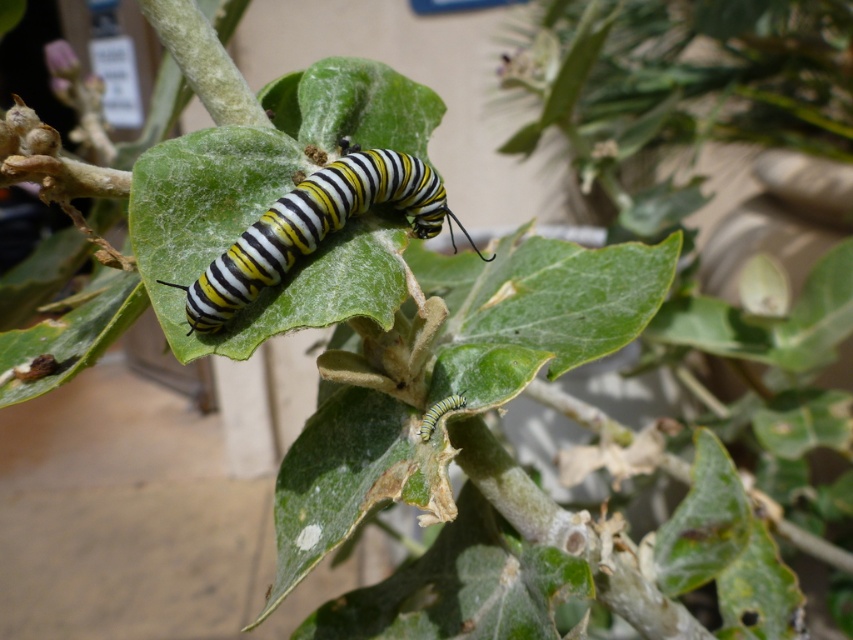
Question: Which of the following is the farthest from the observer?

Choices:
 (A) yellow-black striped caterpillar at center
 (B) yellow striped caterpillar at lower center

Answer: (B)

Question: Which object appears farthest from the camera in this image?

Choices:
 (A) yellow-black striped caterpillar at center
 (B) yellow striped caterpillar at lower center

Answer: (B)

Question: Can you confirm if yellow-black striped caterpillar at center is bigger than yellow striped caterpillar at lower center?

Choices:
 (A) no
 (B) yes

Answer: (B)

Question: Does yellow-black striped caterpillar at center appear over yellow striped caterpillar at lower center?

Choices:
 (A) yes
 (B) no

Answer: (A)

Question: Does yellow-black striped caterpillar at center appear over yellow striped caterpillar at lower center?

Choices:
 (A) no
 (B) yes

Answer: (B)